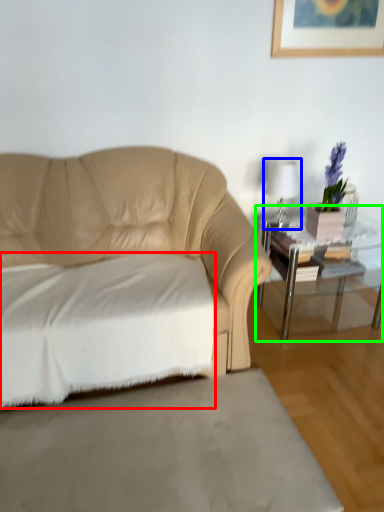
Question: Based on their relative distances, which object is nearer to sheet (highlighted by a red box)? Choose from table lamp (highlighted by a blue box) and table (highlighted by a green box).

Choices:
 (A) table lamp
 (B) table

Answer: (B)